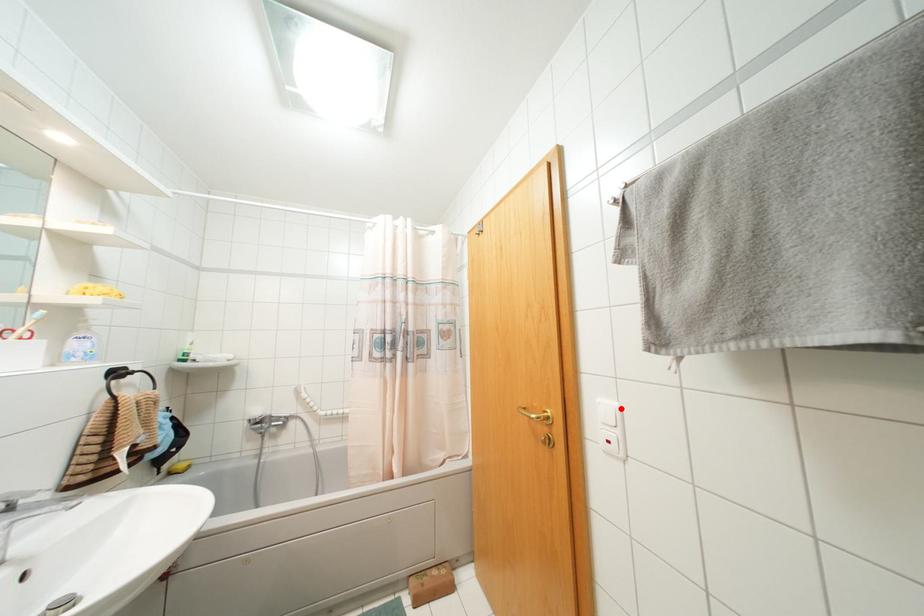
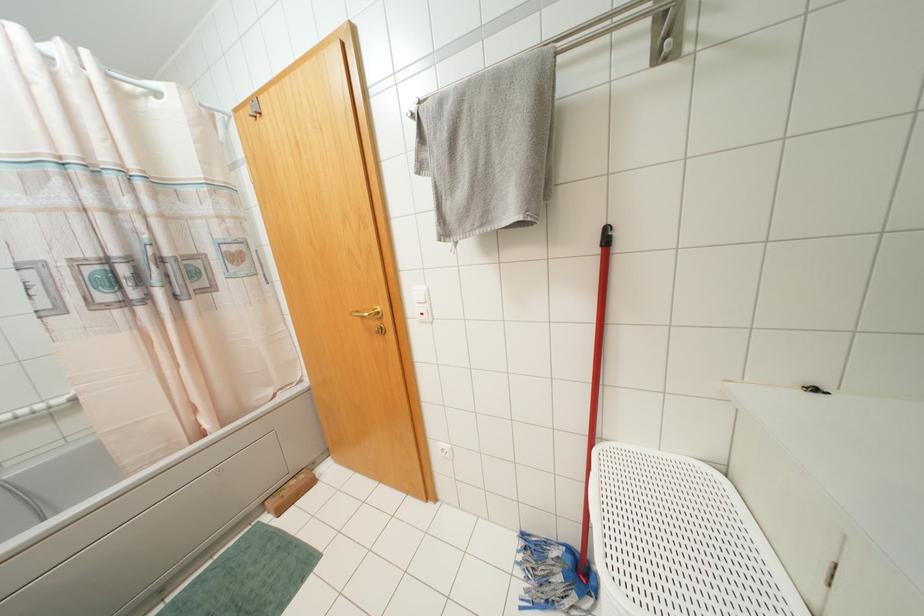
Where in the second image is the point corresponding to the highlighted location from the first image?

(428, 290)